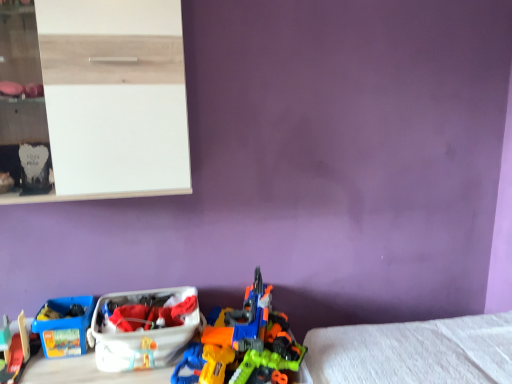
Locate an element on the screen. vacant area that lies between white plastic storage box at lower left, positioned as the 2th storage box in left-to-right order, and blue plastic storage box at lower left, the 1th storage box in the left-to-right sequence is located at coordinates (72, 368).